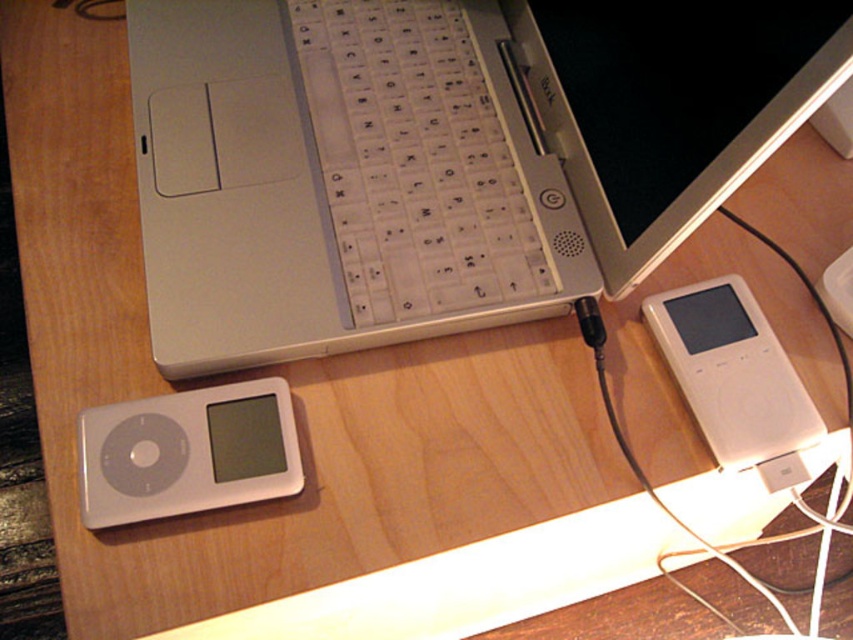
You are organizing the desk and need to move the white glossy ipod at lower left and the white plastic ipod at right. Which ipod should you move first to access the one underneath it?

The white glossy ipod at lower left is positioned under the white plastic ipod at right, so you should move the white plastic ipod at right first to access the one underneath it.

You are organizing the desk and want to place a new wireless charger between the white plastic keyboard at center and the white glossy ipod at lower left. Based on their positions, where should the charger be placed?

The white glossy ipod at lower left is behind the white plastic keyboard at center, so the wireless charger should be placed in front of the white plastic keyboard at center to be between them.